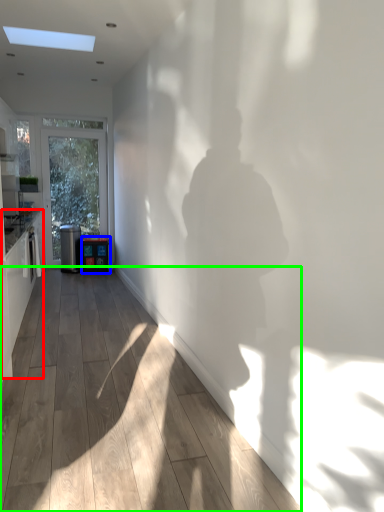
Question: Based on their relative distances, which object is farther from cabinetry (highlighted by a red box)? Choose from appliance (highlighted by a blue box) and corridor (highlighted by a green box).

Choices:
 (A) appliance
 (B) corridor

Answer: (A)